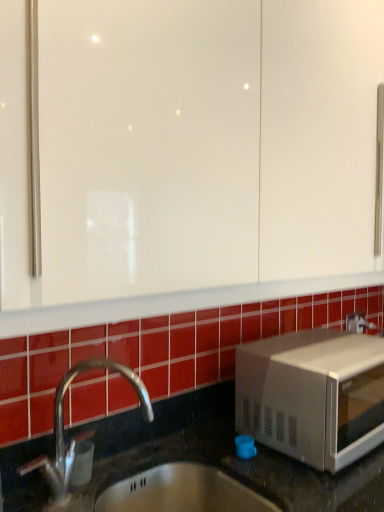
This screenshot has height=512, width=384. What are the coordinates of `free space above white matte microwave at lower right (from a real-world perspective)` in the screenshot? It's located at (326, 345).